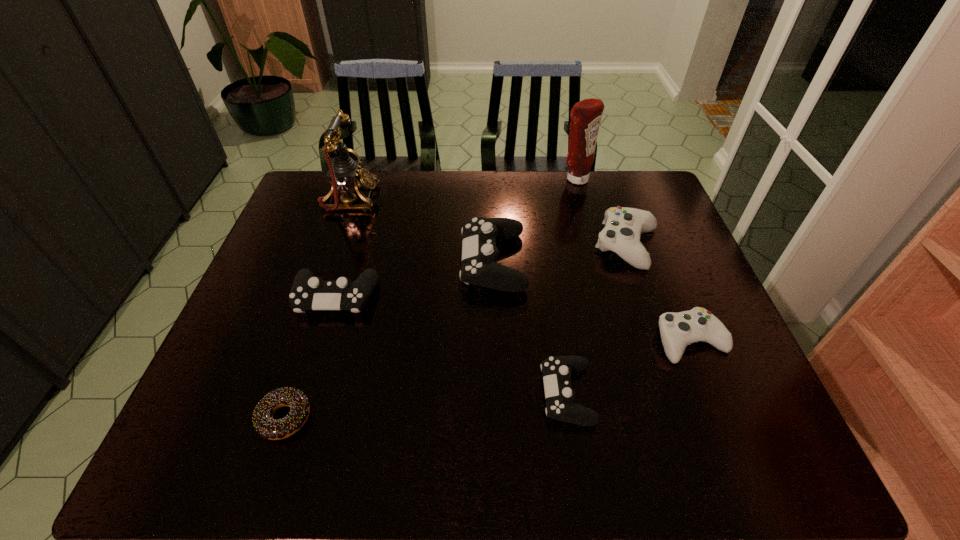
This screenshot has height=540, width=960. I want to click on red condiment, so click(585, 115).

In order to click on black telephone in this screenshot , I will do `click(345, 175)`.

Locate an element on the screen. The width and height of the screenshot is (960, 540). the third tallest object is located at coordinates (479, 267).

The height and width of the screenshot is (540, 960). I want to click on the biggest black control, so click(x=479, y=267).

Image resolution: width=960 pixels, height=540 pixels. I want to click on the bigger white control, so click(x=623, y=226).

This screenshot has height=540, width=960. Identify the location of the leftmost control. (307, 293).

The image size is (960, 540). I want to click on the second smallest black control, so 307,293.

Image resolution: width=960 pixels, height=540 pixels. Find the location of `the smaller white control`. the smaller white control is located at coordinates (678, 330).

At what (x,y) coordinates should I click in order to perform the action: click on the fifth object from left to right. Please return your answer as a coordinate pair (x, y). Looking at the image, I should click on [x=557, y=370].

The image size is (960, 540). In order to click on the third control from right to left in this screenshot , I will do `click(557, 370)`.